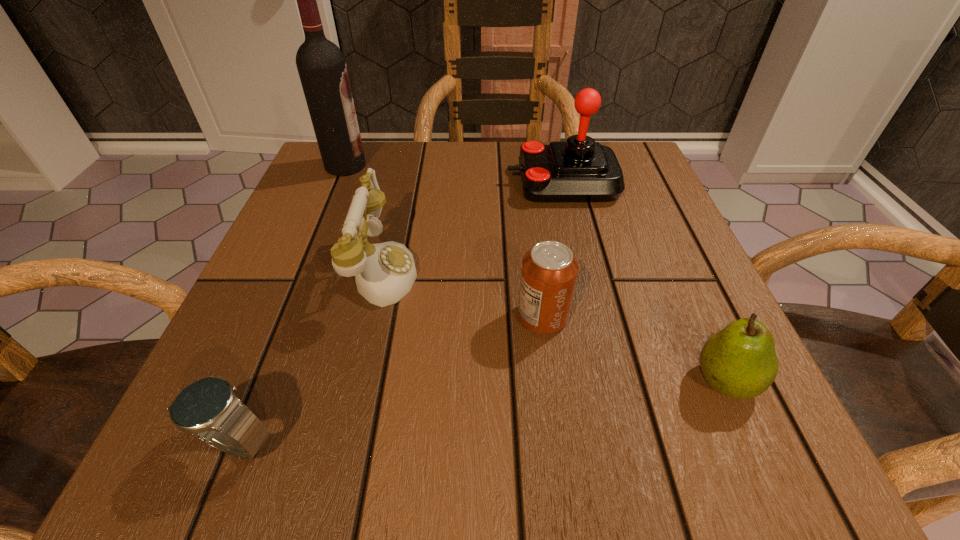
Find the location of a particular element. This screenshot has height=540, width=960. vacant space that satisfies the following two spatial constraints: 1. on the dial of the telephone; 2. on the front side of the watch is located at coordinates (341, 442).

Find the location of `vacant space that satisfies the following two spatial constraints: 1. on the dial of the telephone; 2. on the left side of the can`. vacant space that satisfies the following two spatial constraints: 1. on the dial of the telephone; 2. on the left side of the can is located at coordinates (370, 317).

Locate an element on the screen. This screenshot has height=540, width=960. free region that satisfies the following two spatial constraints: 1. on the dial of the telephone; 2. on the right side of the can is located at coordinates (370, 317).

Locate an element on the screen. The height and width of the screenshot is (540, 960). vacant position in the image that satisfies the following two spatial constraints: 1. on the label of the fifth farthest object; 2. on the left side of the wine bottle is located at coordinates (257, 381).